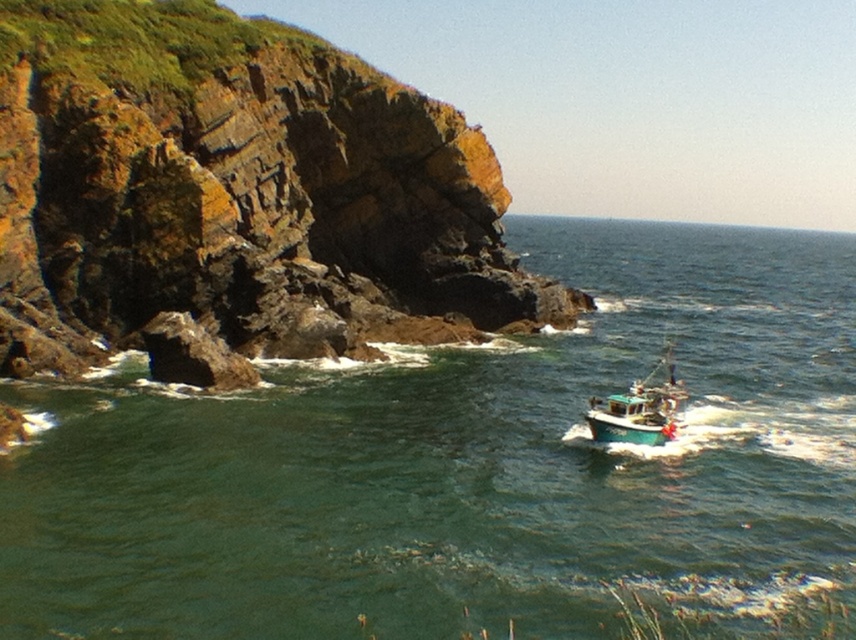
Question: Is green water at lower center to the right of rusty rock at left from the viewer's perspective?

Choices:
 (A) yes
 (B) no

Answer: (A)

Question: Does green water at lower center have a greater width compared to rusty rock at left?

Choices:
 (A) yes
 (B) no

Answer: (A)

Question: Estimate the real-world distances between objects in this image. Which object is closer to the green water at lower center?

Choices:
 (A) teal matte fishing boat at lower right
 (B) rusty rock at left

Answer: (B)

Question: Is green water at lower center wider than rusty rock at left?

Choices:
 (A) no
 (B) yes

Answer: (B)

Question: Which object is positioned closest to the teal matte fishing boat at lower right?

Choices:
 (A) green water at lower center
 (B) rusty rock at left

Answer: (B)

Question: Among these objects, which one is nearest to the camera?

Choices:
 (A) rusty rock at left
 (B) teal matte fishing boat at lower right

Answer: (B)